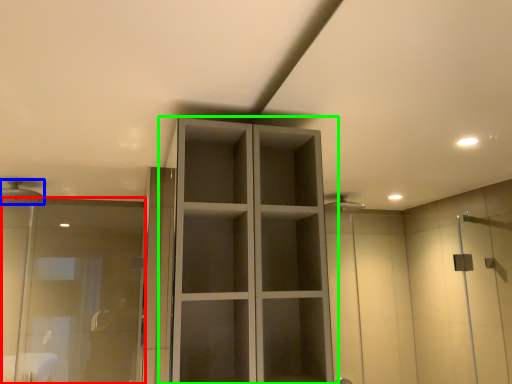
Question: Which is nearer to the screen door (highlighted by a red box)? shower (highlighted by a blue box) or cupboard (highlighted by a green box).

Choices:
 (A) shower
 (B) cupboard

Answer: (A)